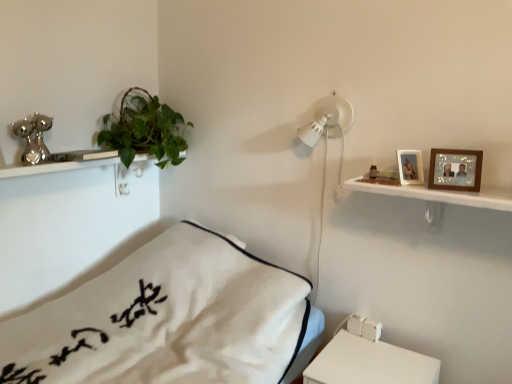
Locate an element on the screen. free location above white matte table at lower right (from a real-world perspective) is located at coordinates (354, 353).